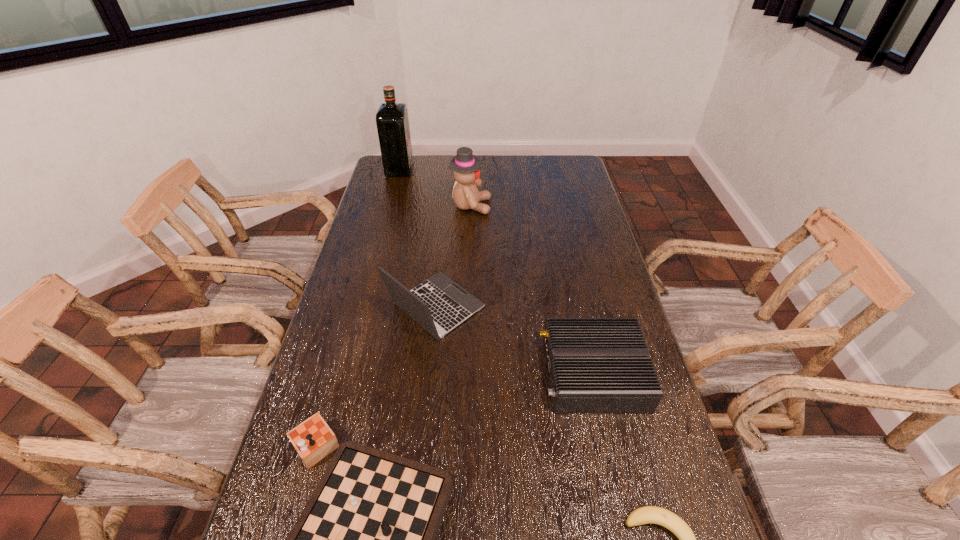
Identify the location of free spot between the laptop_computer and the fifth nearest object. (453, 256).

The height and width of the screenshot is (540, 960). I want to click on vacant area that lies between the farthest object and the second farthest object, so click(x=435, y=187).

Identify which object is the third nearest to the chessboard. Please provide its 2D coordinates. Your answer should be formatted as a tuple, i.e. [(x, y)], where the tuple contains the x and y coordinates of a point satisfying the conditions above.

[(648, 514)]

Identify which object is the third nearest to the liquor. Please provide its 2D coordinates. Your answer should be formatted as a tuple, i.e. [(x, y)], where the tuple contains the x and y coordinates of a point satisfying the conditions above.

[(596, 365)]